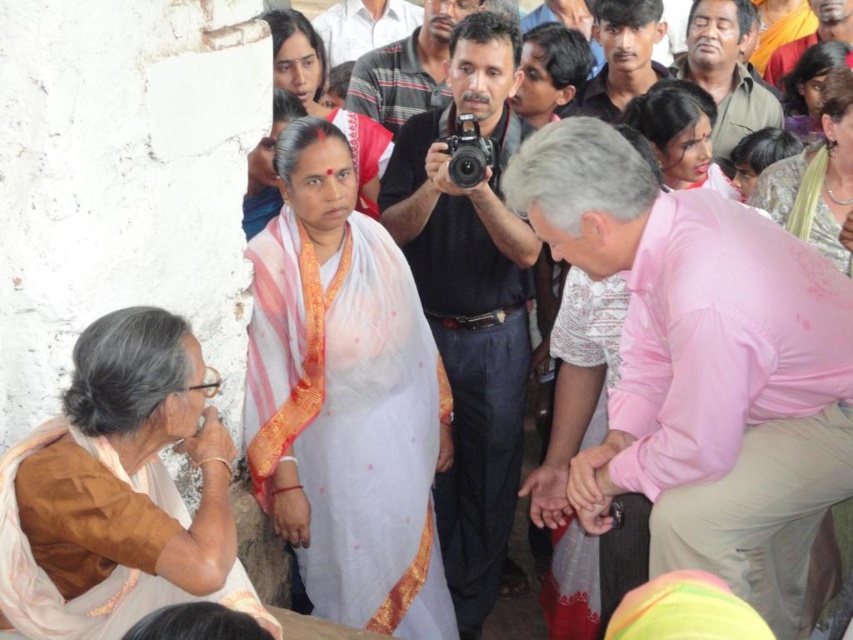
Question: Which of the following is the closest to the observer?

Choices:
 (A) tap(659, 113)
 (B) tap(277, 22)
 (C) tap(692, 204)
 (D) tap(38, 570)

Answer: (D)

Question: Considering the real-world distances, which object is farthest from the light brown fabric shirt at upper right?

Choices:
 (A) white sheer saree at center
 (B) brown silk saree at lower left
 (C) striped cotton shirt at center

Answer: (B)

Question: Observing the image, what is the correct spatial positioning of matte pink blouse at upper right in reference to dark brown hair at center?

Choices:
 (A) right
 (B) left

Answer: (A)

Question: Is pink smooth shirt at center to the left of black cotton shirt at center from the viewer's perspective?

Choices:
 (A) yes
 (B) no

Answer: (B)

Question: Which object appears farthest from the camera in this image?

Choices:
 (A) matte pink saree at upper right
 (B) matte pink blouse at upper right
 (C) dark brown hair at center

Answer: (C)

Question: In this image, where is white sheer saree at center located relative to brown textured shirt at upper right?

Choices:
 (A) below
 (B) above

Answer: (A)